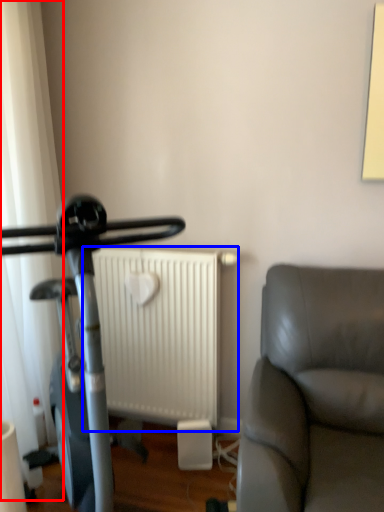
Question: Which point is further to the camera, curtain (highlighted by a red box) or radiator (highlighted by a blue box)?

Choices:
 (A) curtain
 (B) radiator

Answer: (B)